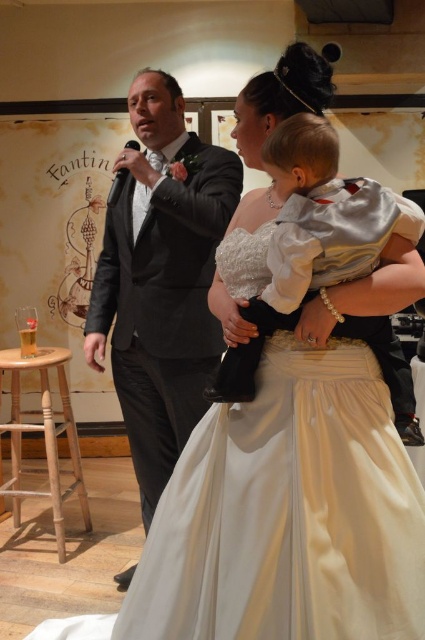
You are planning to seat guests at a table that can only accommodate one person comfortably. You see the matte black suit at center and the white satin baby at center. Which one requires more space for seating?

The matte black suit at center might require more space for seating since it is wider than the white satin baby at center according to the description.

You are a photographer at the wedding venue named Fantin. You need to position a 1.8 meter tall photographer stand between the matte black suit at center and the light brown wooden stool at lower left. Can the stand fit vertically between them without exceeding their heights?

The matte black suit at center is taller than the light brown wooden stool at lower left. Since the photographer stand is 1.8 meters tall, it cannot fit vertically between them as it would exceed the height of both objects.